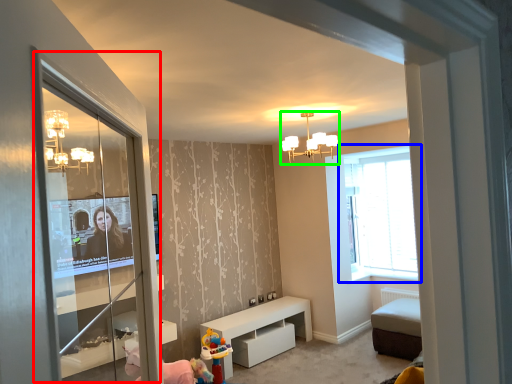
Question: Based on their relative distances, which object is farther from screen door (highlighted by a red box)? Choose from window (highlighted by a blue box) and light fixture (highlighted by a green box).

Choices:
 (A) window
 (B) light fixture

Answer: (A)